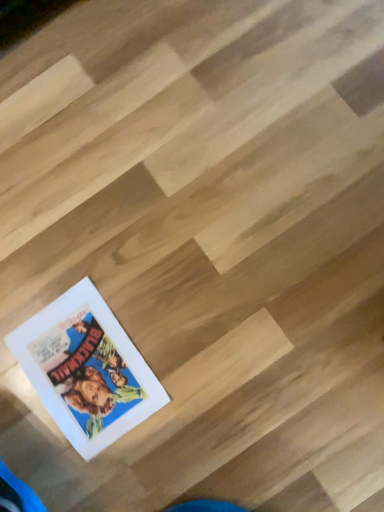
What is the approximate height of matte paper book at bottom left?

matte paper book at bottom left is 2.72 centimeters tall.

This screenshot has width=384, height=512. I want to click on matte paper book at bottom left, so click(x=86, y=369).

Describe the element at coordinates (86, 369) in the screenshot. I see `matte paper book at bottom left` at that location.

Image resolution: width=384 pixels, height=512 pixels. I want to click on matte paper book at bottom left, so click(86, 369).